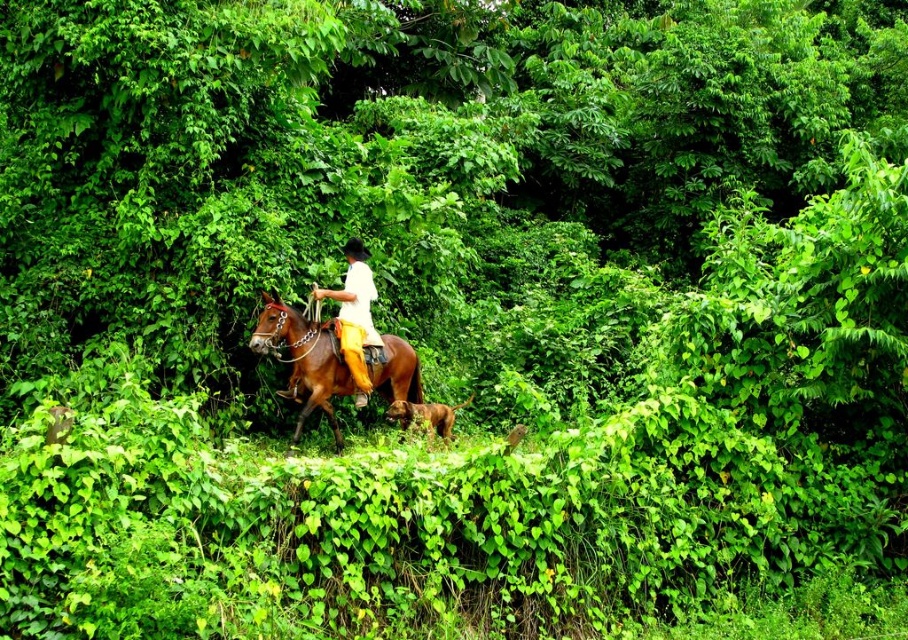
Question: Can you confirm if brown glossy horse at center is positioned above yellow fabric pants at center?

Choices:
 (A) yes
 (B) no

Answer: (B)

Question: Can you confirm if brown glossy horse at center is thinner than yellow fabric pants at center?

Choices:
 (A) yes
 (B) no

Answer: (B)

Question: Can you confirm if brown glossy horse at center is positioned to the left of yellow fabric pants at center?

Choices:
 (A) yes
 (B) no

Answer: (A)

Question: Which object appears farthest from the camera in this image?

Choices:
 (A) yellow fabric pants at center
 (B) brown glossy horse at center

Answer: (A)

Question: Among these objects, which one is nearest to the camera?

Choices:
 (A) brown glossy horse at center
 (B) yellow fabric pants at center

Answer: (A)